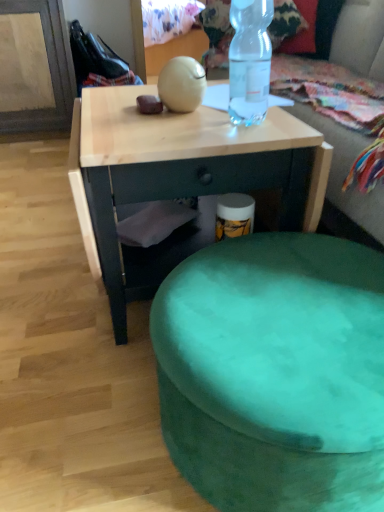
At what (x,y) coordinates should I click in order to perform the action: click on free space to the back side of transparent plastic bottle at upper center. Please return your answer as a coordinate pair (x, y). Image resolution: width=384 pixels, height=512 pixels. Looking at the image, I should click on (226, 105).